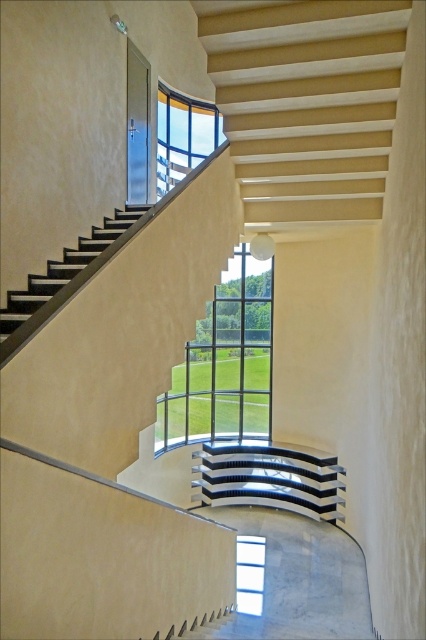
Question: Among these objects, which one is nearest to the camera?

Choices:
 (A) clear glass window at upper center
 (B) black glossy stair at center

Answer: (A)

Question: Which object is the farthest from the black matte stairs at left?

Choices:
 (A) transparent glass window at center
 (B) clear glass window at upper center
 (C) clear glass window at center

Answer: (A)

Question: Which of these objects is positioned farthest from the black glossy stair at center?

Choices:
 (A) transparent glass window at center
 (B) clear glass window at upper center
 (C) clear glass window at center
 (D) smooth beige stairs at lower center

Answer: (B)

Question: In this image, where is clear glass window at center located relative to transparent glass window at center?

Choices:
 (A) above
 (B) below

Answer: (A)

Question: Observing the image, what is the correct spatial positioning of clear glass window at upper center in reference to black matte stairs at left?

Choices:
 (A) above
 (B) below

Answer: (A)

Question: Is black glossy stair at center smaller than clear glass window at upper center?

Choices:
 (A) no
 (B) yes

Answer: (B)